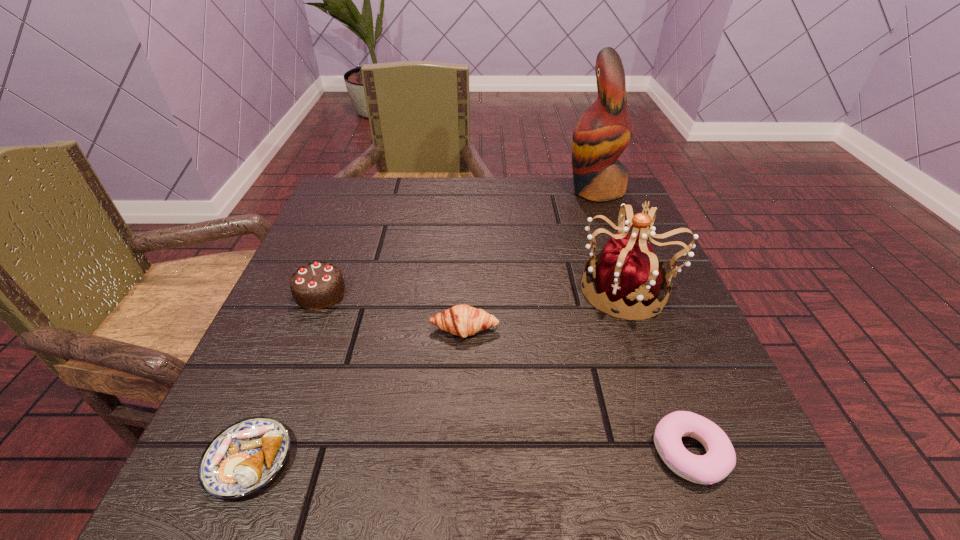
What are the coordinates of `vacant space at the far left corner` in the screenshot? It's located at pos(348,219).

Where is `free space at the far right corner of the desktop`? This screenshot has width=960, height=540. free space at the far right corner of the desktop is located at coordinates pos(581,198).

Where is `free space at the near right corner of the desktop`? The image size is (960, 540). free space at the near right corner of the desktop is located at coordinates (644, 454).

At what (x,y) coordinates should I click in order to perform the action: click on empty space that is in between the leftmost pastry and the rightmost pastry. Please return your answer as a coordinate pair (x, y). The image size is (960, 540). Looking at the image, I should click on (469, 457).

Find the location of `free space between the tiara and the leftmost pastry`. free space between the tiara and the leftmost pastry is located at coordinates (439, 374).

Where is `unoccupied position between the rightmost pastry and the fourth object from right to left`? The width and height of the screenshot is (960, 540). unoccupied position between the rightmost pastry and the fourth object from right to left is located at coordinates (577, 392).

I want to click on vacant space that's between the chocolate cake and the rightmost pastry, so click(x=505, y=373).

The image size is (960, 540). I want to click on free space between the leftmost pastry and the chocolate cake, so click(x=284, y=376).

Identify the location of free space between the rightmost pastry and the tiara. The width and height of the screenshot is (960, 540). (659, 372).

Identify the location of free area in between the farthest object and the rightmost pastry. (642, 322).